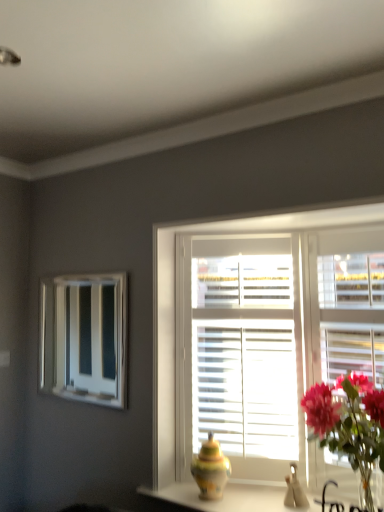
What are the coordinates of `free point above white glossy mirror at upper left (from a real-world perspective)` in the screenshot? It's located at (91, 268).